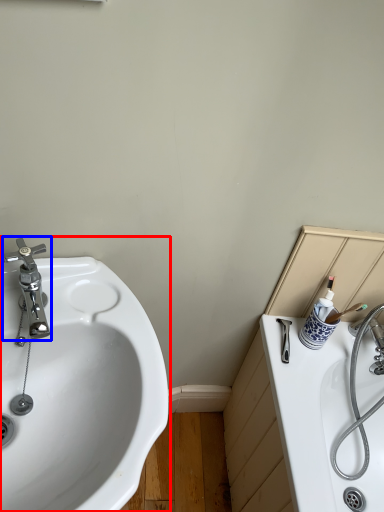
Question: Which object appears closest to the camera in this image, sink (highlighted by a red box) or tap (highlighted by a blue box)?

Choices:
 (A) sink
 (B) tap

Answer: (A)